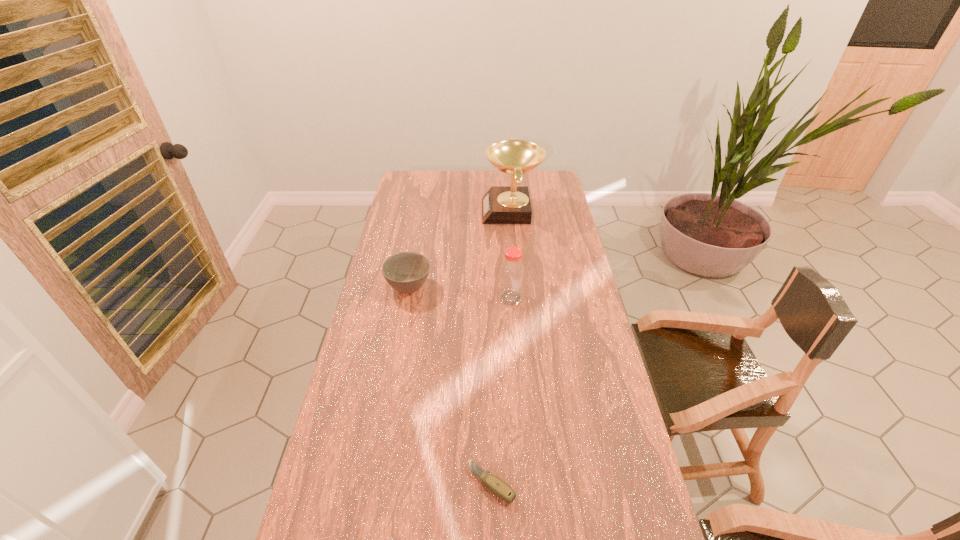
Identify the location of free space that satisfies the following two spatial constraints: 1. on the front-facing side of the farthest object; 2. on the front side of the second tallest object. (519, 298).

This screenshot has width=960, height=540. I want to click on blank area in the image that satisfies the following two spatial constraints: 1. on the front-facing side of the award; 2. on the front side of the nearest object, so click(538, 483).

Locate an element on the screen. Image resolution: width=960 pixels, height=540 pixels. vacant position in the image that satisfies the following two spatial constraints: 1. on the front-facing side of the farthest object; 2. on the front side of the shortest object is located at coordinates (538, 483).